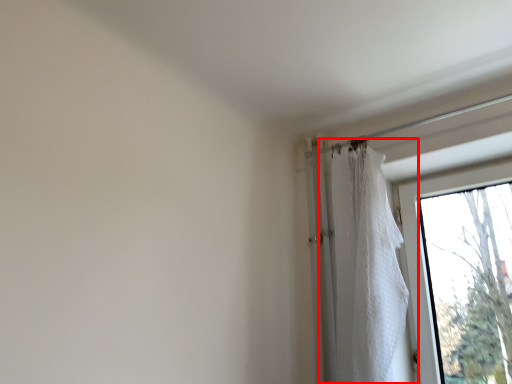
Question: Observing the image, what is the correct spatial positioning of curtain (annotated by the red box) in reference to window?

Choices:
 (A) left
 (B) right

Answer: (A)